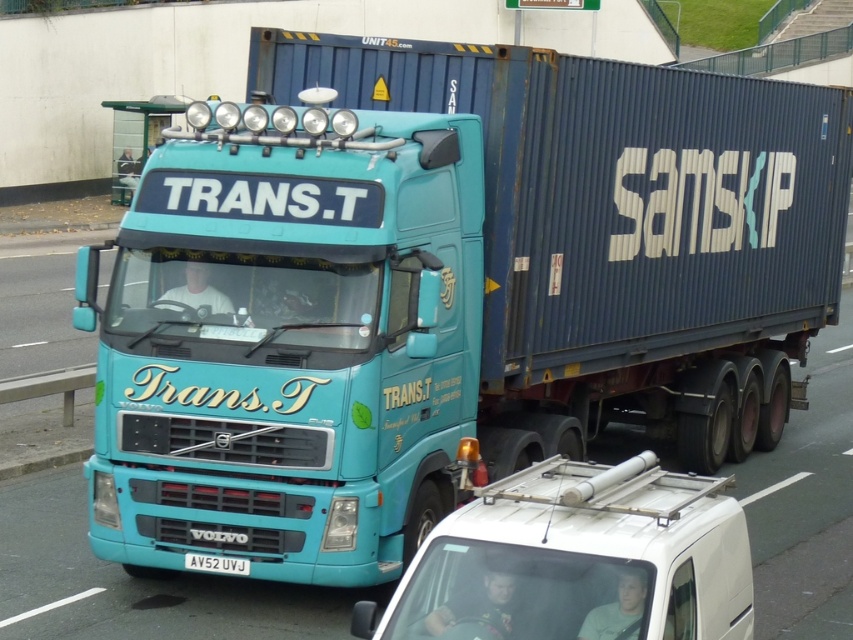
Question: Is white matte van at center thinner than white plastic license plate at center?

Choices:
 (A) yes
 (B) no

Answer: (B)

Question: Does white matte van at center appear under white plastic license plate at center?

Choices:
 (A) yes
 (B) no

Answer: (B)

Question: Does white matte van at center have a larger size compared to white plastic license plate at center?

Choices:
 (A) yes
 (B) no

Answer: (A)

Question: Which point is closer to the camera taking this photo?

Choices:
 (A) (189, 557)
 (B) (622, 584)

Answer: (B)